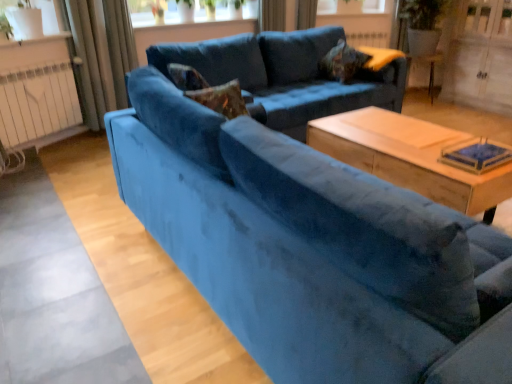
Question: Is velvet textured pillow at upper center taller than velvet blue curtain at upper center, the 3th curtain positioned from the left?

Choices:
 (A) no
 (B) yes

Answer: (A)

Question: Can you see velvet textured pillow at upper center touching velvet blue curtain at upper center, the 3th curtain positioned from the left?

Choices:
 (A) yes
 (B) no

Answer: (B)

Question: Is velvet textured pillow at upper center bigger than velvet blue curtain at upper center, the 3th curtain positioned from the left?

Choices:
 (A) yes
 (B) no

Answer: (A)

Question: Is velvet textured pillow at upper center aimed at velvet blue curtain at upper center, the 3th curtain positioned from the left?

Choices:
 (A) yes
 (B) no

Answer: (B)

Question: Can you confirm if velvet textured pillow at upper center is shorter than velvet blue curtain at upper center, which is counted as the 1th curtain, starting from the right?

Choices:
 (A) yes
 (B) no

Answer: (A)

Question: Considering the relative sizes of velvet textured pillow at upper center and velvet blue curtain at upper center, the 3th curtain positioned from the left, in the image provided, is velvet textured pillow at upper center smaller than velvet blue curtain at upper center, the 3th curtain positioned from the left,?

Choices:
 (A) no
 (B) yes

Answer: (A)

Question: Are wooden coffee table at center and wooden side table at right far apart?

Choices:
 (A) no
 (B) yes

Answer: (B)

Question: Is wooden coffee table at center not inside wooden side table at right?

Choices:
 (A) no
 (B) yes

Answer: (B)

Question: Is wooden coffee table at center positioned before wooden side table at right?

Choices:
 (A) no
 (B) yes

Answer: (B)

Question: Considering the relative sizes of wooden coffee table at center and wooden side table at right in the image provided, is wooden coffee table at center smaller than wooden side table at right?

Choices:
 (A) no
 (B) yes

Answer: (A)

Question: Is wooden coffee table at center shorter than wooden side table at right?

Choices:
 (A) yes
 (B) no

Answer: (A)

Question: Can you confirm if wooden coffee table at center is taller than wooden side table at right?

Choices:
 (A) no
 (B) yes

Answer: (A)

Question: Is velvet blue curtain at upper center, which is counted as the 1th curtain, starting from the right, at the left side of white wood screen door at upper right?

Choices:
 (A) yes
 (B) no

Answer: (A)